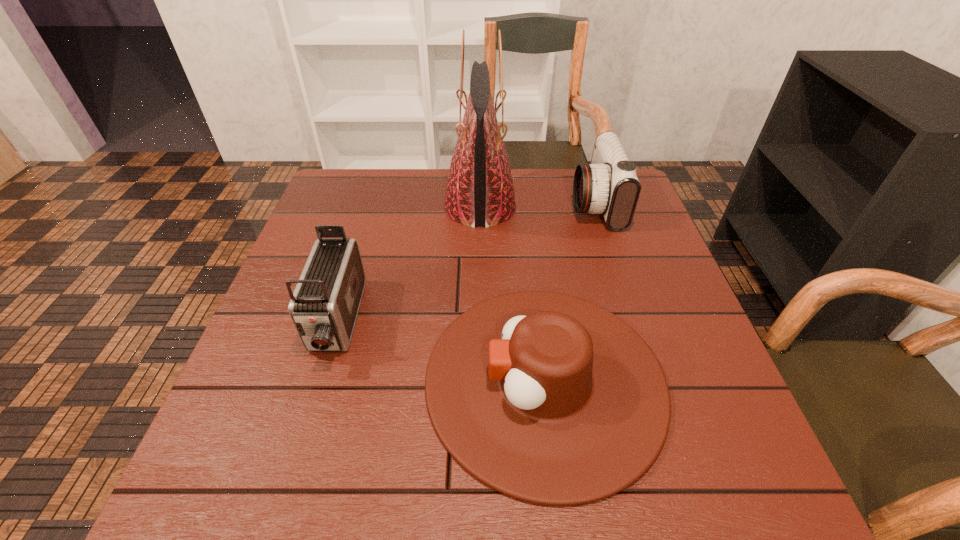
You are a GUI agent. You are given a task and a screenshot of the screen. Output one action in this format:
    pyautogui.click(x=<x>, y=<y>)
    Task: Click on the object present at the near right corner
    This screenshot has width=960, height=540.
    Given the screenshot: What is the action you would take?
    pos(548,398)

Where is `free region at the far edge of the desktop`? free region at the far edge of the desktop is located at coordinates (424, 182).

In the image, there is a desktop. At what (x,y) coordinates should I click in order to perform the action: click on vacant space at the left edge. Please return your answer as a coordinate pair (x, y). The image size is (960, 540). Looking at the image, I should click on (301, 384).

Identify the location of blank space at the right edge of the desktop. (641, 336).

The image size is (960, 540). Identify the location of vacant area at the far left corner of the desktop. (362, 215).

At what (x,y) coordinates should I click in order to perform the action: click on free spot at the near left corner of the desktop. Please return your answer as a coordinate pair (x, y). Looking at the image, I should click on (238, 508).

I want to click on vacant space at the far right corner of the desktop, so click(x=644, y=214).

I want to click on vacant space that's between the leftmost object and the tallest object, so click(408, 265).

Identify the location of free space between the right camcorder and the shortest object. click(x=570, y=292).

Identify the location of free area in between the handbag and the leftmost object. The height and width of the screenshot is (540, 960). (408, 265).